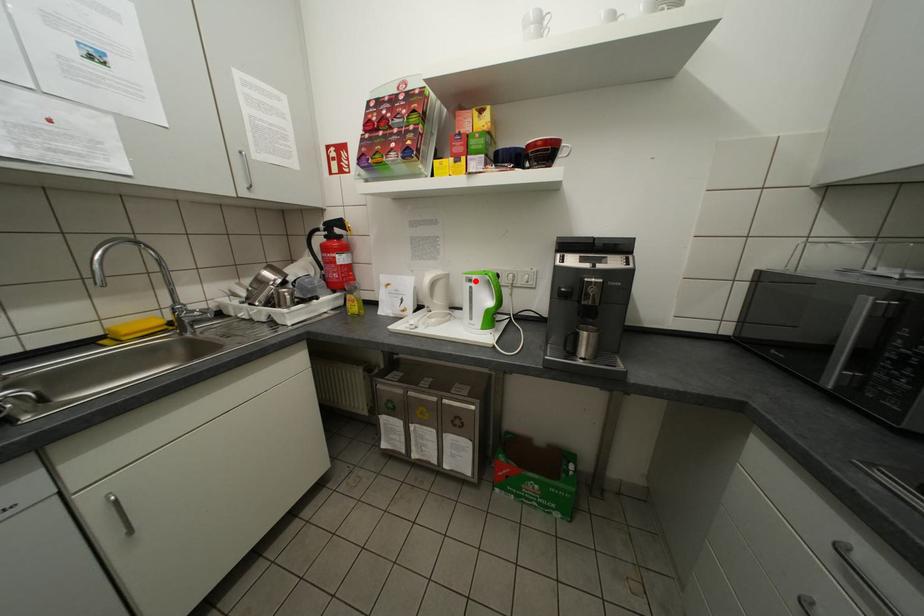
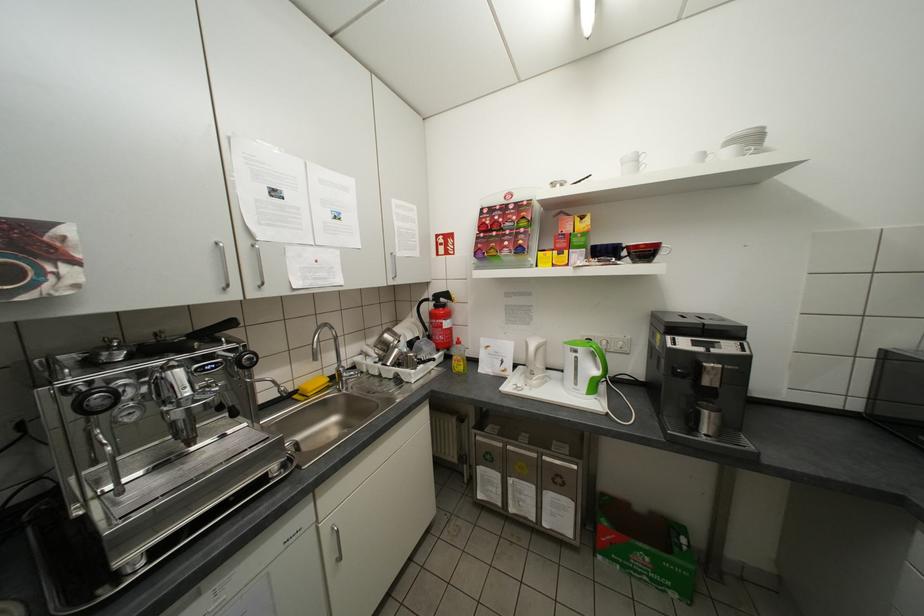
In the second image, find the point that corresponds to the highlighted location in the first image.

(579, 351)